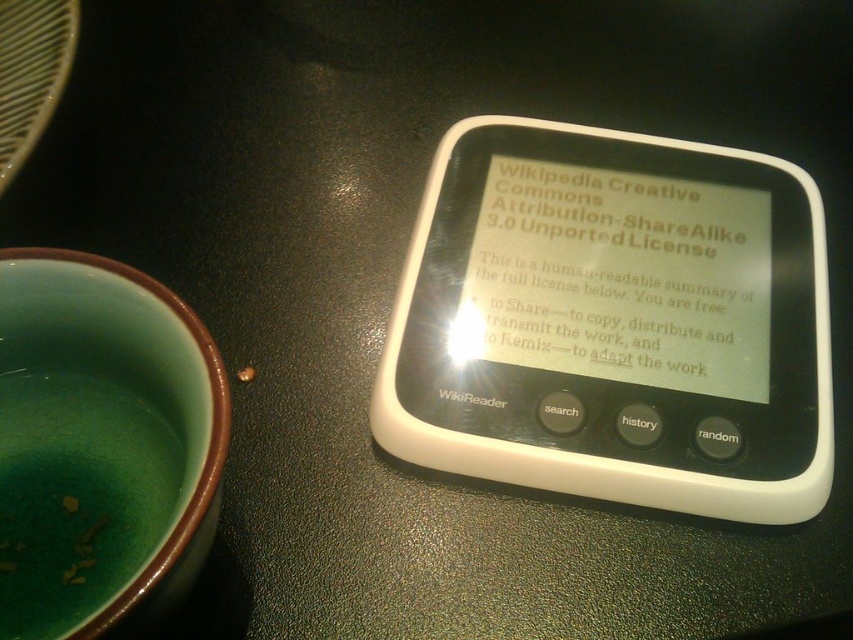
Question: Can you confirm if black plastic wikireader at center is wider than white matte wikireader at center?

Choices:
 (A) no
 (B) yes

Answer: (B)

Question: Does black plastic wikireader at center come behind white paper at center?

Choices:
 (A) no
 (B) yes

Answer: (A)

Question: Which object is closer to the camera taking this photo?

Choices:
 (A) white matte wikireader at center
 (B) white paper at center

Answer: (A)

Question: Which is nearer to the black plastic wikireader at center?

Choices:
 (A) white matte wikireader at center
 (B) white paper at center

Answer: (B)

Question: Does black plastic wikireader at center have a larger size compared to white paper at center?

Choices:
 (A) yes
 (B) no

Answer: (A)

Question: Based on their relative distances, which object is farther from the white matte wikireader at center?

Choices:
 (A) white paper at center
 (B) black plastic wikireader at center

Answer: (A)